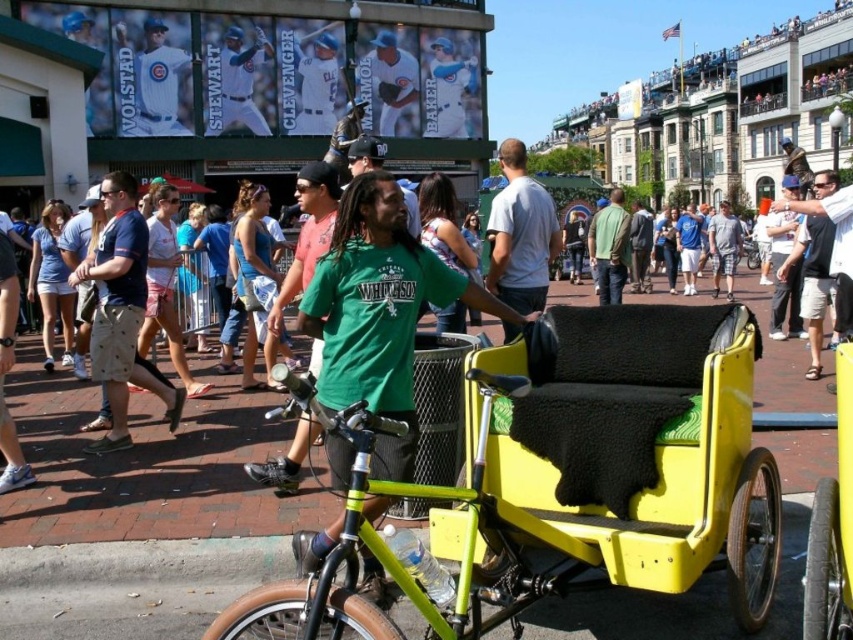
Question: Can you confirm if yellow matte rickshaw at center is positioned below dark gray jacket at center?

Choices:
 (A) no
 (B) yes

Answer: (B)

Question: Which point is farther from the camera taking this photo?

Choices:
 (A) (715, 216)
 (B) (143, 362)

Answer: (A)

Question: Is light blue shirt at center thinner than light blue shorts at center?

Choices:
 (A) yes
 (B) no

Answer: (B)

Question: Estimate the real-world distances between objects in this image. Which object is closer to the metallic silver stadium at upper center?

Choices:
 (A) khaki shorts at center
 (B) green cotton shirt at center
 (C) yellow matte rickshaw at center
 (D) light blue shirt at center

Answer: (B)

Question: Can you confirm if yellow matte pedicab at center is bigger than gray cotton shirt at center?

Choices:
 (A) no
 (B) yes

Answer: (A)

Question: Estimate the real-world distances between objects in this image. Which object is farther from the yellow matte rickshaw at center?

Choices:
 (A) light blue shorts at center
 (B) metallic silver stadium at upper center
 (C) yellow matte pedicab at center
 (D) gray cotton shirt at center

Answer: (B)